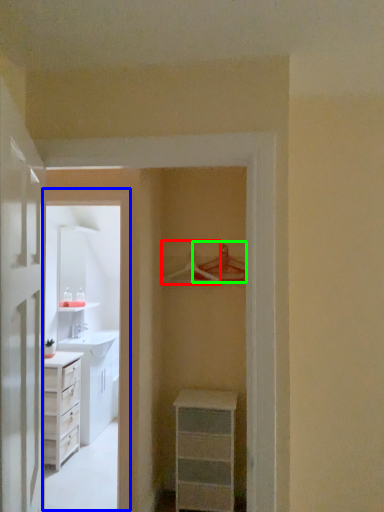
Question: Which object is the closest to the hanger (highlighted by a red box)? Choose among these: corridor (highlighted by a blue box) or hanger (highlighted by a green box).

Choices:
 (A) corridor
 (B) hanger

Answer: (B)